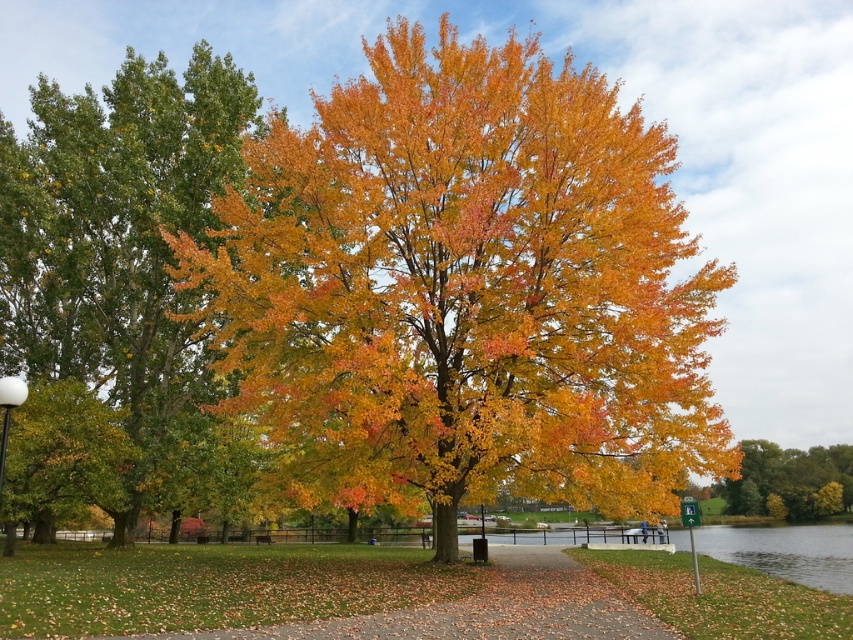
Question: Which point is farther to the camera?

Choices:
 (A) white glossy lamp post at lower left
 (B) green leafy tree at left
 (C) golden yellow leaves at right
 (D) golden yellow leaves at center

Answer: (C)

Question: Is golden yellow leaves at center positioned before green leafy tree at left?

Choices:
 (A) yes
 (B) no

Answer: (A)

Question: Which point is closer to the camera?

Choices:
 (A) golden yellow leaves at center
 (B) green leafy tree at left

Answer: (A)

Question: Which of the following is the farthest from the observer?

Choices:
 (A) (32, 460)
 (B) (9, 388)

Answer: (A)

Question: Is green leafy tree at left thinner than golden yellow leaves at right?

Choices:
 (A) yes
 (B) no

Answer: (B)

Question: Considering the relative positions of golden yellow leaves at right and white glossy lamp post at lower left in the image provided, where is golden yellow leaves at right located with respect to white glossy lamp post at lower left?

Choices:
 (A) below
 (B) above

Answer: (A)